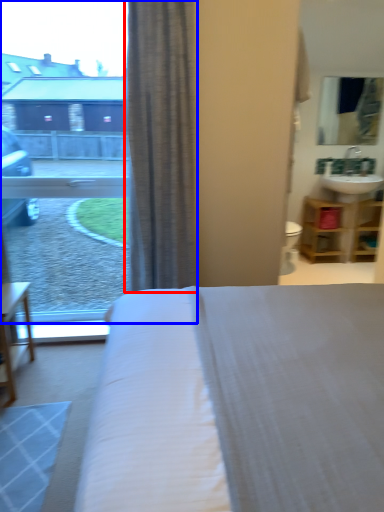
Question: Which of the following is the farthest to the observer, curtain (highlighted by a red box) or window (highlighted by a blue box)?

Choices:
 (A) curtain
 (B) window

Answer: (B)